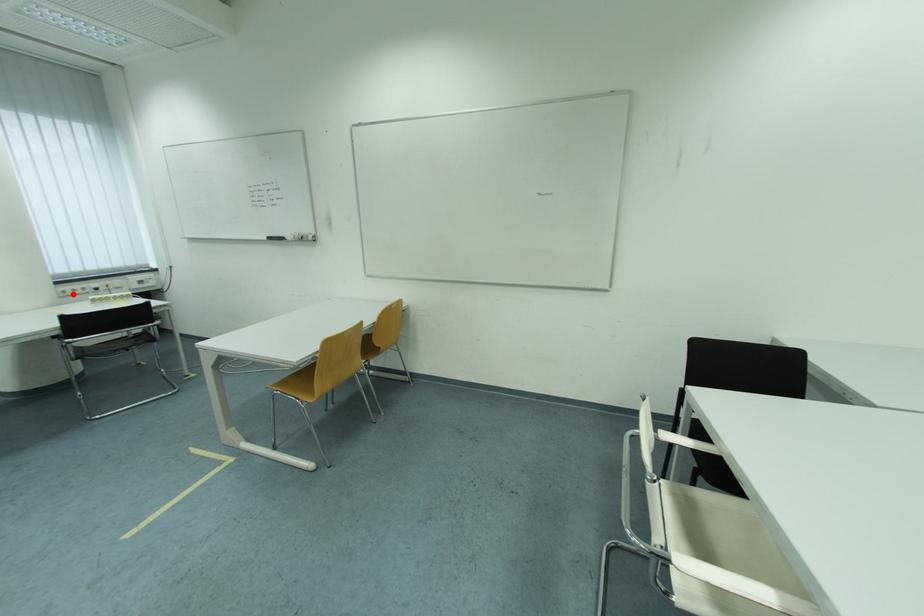
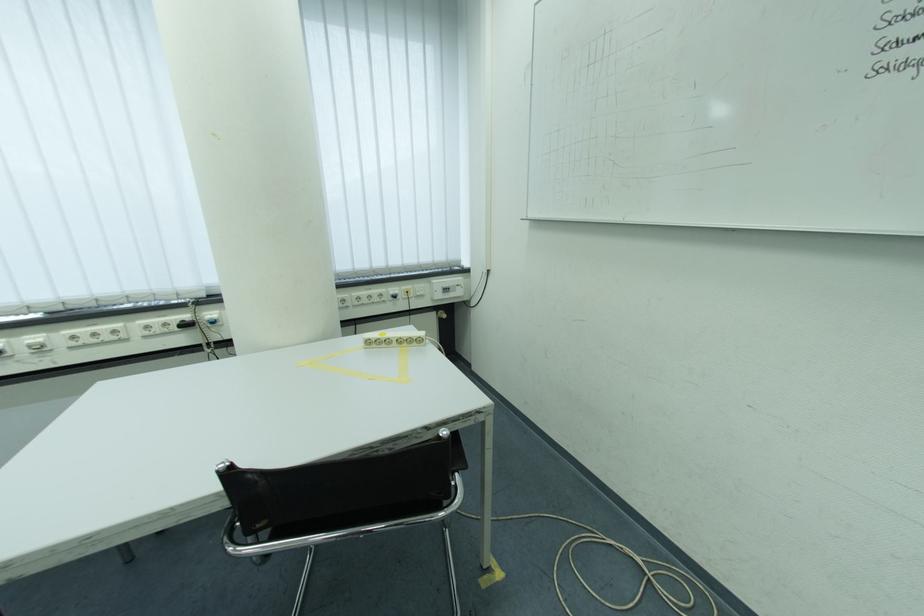
Question: I am providing you with two images of the same scene from different viewpoints. In image1, a red point is highlighted. Considering the same 3D point in image2, which of the following is correct?

Choices:
 (A) It is closer
 (B) It is farther

Answer: (A)